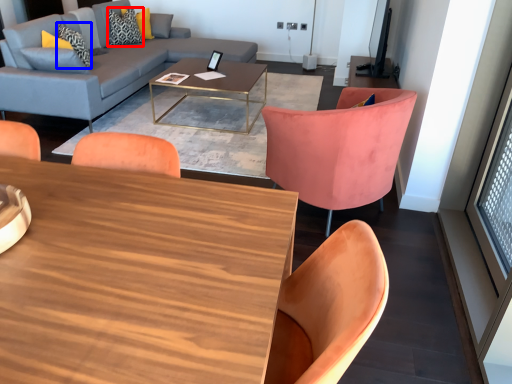
Question: Which object appears closest to the camera in this image, pillow (highlighted by a red box) or pillow (highlighted by a blue box)?

Choices:
 (A) pillow
 (B) pillow

Answer: (B)